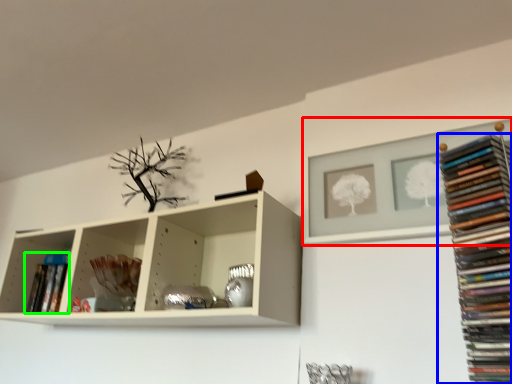
Question: Considering the real-world distances, which object is closest to shelf (highlighted by a red box)? book (highlighted by a blue box) or book (highlighted by a green box).

Choices:
 (A) book
 (B) book

Answer: (A)